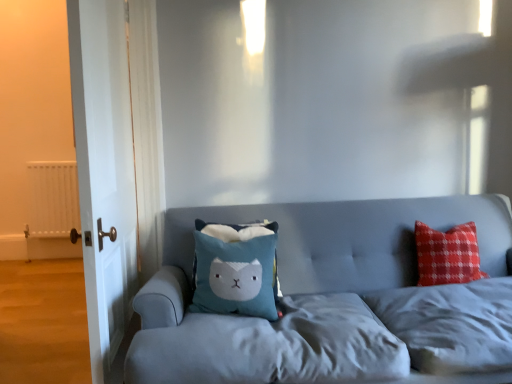
The width and height of the screenshot is (512, 384). What do you see at coordinates (303, 292) in the screenshot?
I see `velvet blue couch at center` at bounding box center [303, 292].

Describe the element at coordinates (236, 270) in the screenshot. The width and height of the screenshot is (512, 384). I see `blue plush pillow at center` at that location.

I want to click on white matte radiator at left, so click(52, 199).

Where is `white wood door at left`? white wood door at left is located at coordinates (104, 171).

Where is `velvet blue couch at center`? This screenshot has height=384, width=512. velvet blue couch at center is located at coordinates (303, 292).

Would you say white wood door at left is outside blue plush pillow at center?

Yes, white wood door at left is outside of blue plush pillow at center.

Is white wood door at left facing towards blue plush pillow at center?

Yes, white wood door at left is facing blue plush pillow at center.

Does point (112, 348) come farther from viewer compared to point (270, 230)?

No, it is in front of (270, 230).

What's the angular difference between white wood door at left and blue plush pillow at center's facing directions?

white wood door at left and blue plush pillow at center are facing 86.9 degrees away from each other.

Is velvet blue couch at center taller or shorter than white wood door at left?

In the image, velvet blue couch at center appears to be shorter than white wood door at left.

Would you say white wood door at left is part of velvet blue couch at center's contents?

No.

Find the location of `door lying above the velvet blue couch at center (from the image's perspective)`. door lying above the velvet blue couch at center (from the image's perspective) is located at coordinates (104, 171).

Is there a large distance between velvet blue couch at center and white wood door at left?

They are positioned close to each other.

Considering the sizes of white matte radiator at left and velvet blue couch at center in the image, is white matte radiator at left wider or thinner than velvet blue couch at center?

In the image, white matte radiator at left appears to be more narrow than velvet blue couch at center.

Image resolution: width=512 pixels, height=384 pixels. In the image, there is a white matte radiator at left. Find the location of `studio couch below it (from the image's perspective)`. studio couch below it (from the image's perspective) is located at coordinates (x=303, y=292).

Does white matte radiator at left appear on the left side of velvet blue couch at center?

Yes.

Would you say white matte radiator at left is a long distance from velvet blue couch at center?

Yes, white matte radiator at left and velvet blue couch at center are located far from each other.

Considering the relative positions of white matte radiator at left and white wood door at left in the image provided, is white matte radiator at left behind white wood door at left?

Yes, white matte radiator at left is further from the camera.

Is white matte radiator at left looking in the opposite direction of white wood door at left?

No, white matte radiator at left is not facing away from white wood door at left.

Is white matte radiator at left wider or thinner than white wood door at left?

Considering their sizes, white matte radiator at left looks slimmer than white wood door at left.

Which of these two, white matte radiator at left or white wood door at left, is bigger?

Bigger between the two is white wood door at left.

From the image's perspective, relative to white matte radiator at left, is white wood door at left above or below?

From the image's perspective, white wood door at left appears above white matte radiator at left.

Image resolution: width=512 pixels, height=384 pixels. Identify the location of radiator below the white wood door at left (from the image's perspective). (52, 199).

Between white wood door at left and white matte radiator at left, which one has less height?

With less height is white matte radiator at left.

Is white wood door at left closer to the viewer compared to white matte radiator at left?

Yes, it is.

Consider the image. Is white matte radiator at left positioned with its back to blue plush pillow at center?

That's not correct — white matte radiator at left is not looking away from blue plush pillow at center.

Who is smaller, white matte radiator at left or blue plush pillow at center?

blue plush pillow at center.

Considering the relative sizes of white matte radiator at left and blue plush pillow at center in the image provided, is white matte radiator at left thinner than blue plush pillow at center?

Correct, the width of white matte radiator at left is less than that of blue plush pillow at center.

Consider the image. Do you think white matte radiator at left is within blue plush pillow at center, or outside of it?

white matte radiator at left lies outside blue plush pillow at center.

Could blue plush pillow at center be considered to be inside velvet blue couch at center?

Yes, blue plush pillow at center can be found within velvet blue couch at center.

How different are the orientations of velvet blue couch at center and blue plush pillow at center in degrees?

They differ by 3.85 degrees in their facing directions.

Does velvet blue couch at center appear on the right side of blue plush pillow at center?

Yes.

Is velvet blue couch at center oriented away from blue plush pillow at center?

Yes, velvet blue couch at center is positioned with its back facing blue plush pillow at center.

Find the location of a particular element. Image resolution: width=512 pixels, height=384 pixels. pillow located below the white wood door at left (from the image's perspective) is located at coordinates (236, 270).

What are the coordinates of `door on the left of velvet blue couch at center` in the screenshot? It's located at (104, 171).

Based on their spatial positions, is velvet blue couch at center or white matte radiator at left further from white wood door at left?

Among the two, white matte radiator at left is located further to white wood door at left.

Looking at the image, which one is located further to blue plush pillow at center, white matte radiator at left or velvet blue couch at center?

white matte radiator at left is positioned further to the anchor blue plush pillow at center.

Based on their spatial positions, is white matte radiator at left or blue plush pillow at center closer to white wood door at left?

blue plush pillow at center.

Looking at the image, which one is located further to white wood door at left, white matte radiator at left or velvet blue couch at center?

white matte radiator at left lies further to white wood door at left than the other object.

Consider the image. When comparing their distances from blue plush pillow at center, does white wood door at left or white matte radiator at left seem closer?

The object closer to blue plush pillow at center is white wood door at left.

From the image, which object appears to be farther from white wood door at left, blue plush pillow at center or velvet blue couch at center?

Among the two, velvet blue couch at center is located further to white wood door at left.

When comparing their distances from white matte radiator at left, does white wood door at left or velvet blue couch at center seem closer?

white wood door at left lies closer to white matte radiator at left than the other object.

Looking at the image, which one is located closer to white matte radiator at left, velvet blue couch at center or white wood door at left?

white wood door at left lies closer to white matte radiator at left than the other object.

Where is `pillow located between white matte radiator at left and velvet blue couch at center in the left-right direction`? The height and width of the screenshot is (384, 512). pillow located between white matte radiator at left and velvet blue couch at center in the left-right direction is located at coordinates point(236,270).

You are a GUI agent. You are given a task and a screenshot of the screen. Output one action in this format:
    pyautogui.click(x=<x>, y=<y>)
    Task: Click on the door between velvet blue couch at center and white matte radiator at left in the front-back direction
    The height and width of the screenshot is (384, 512).
    Given the screenshot: What is the action you would take?
    pyautogui.click(x=104, y=171)

Where is `pillow between white wood door at left and velvet blue couch at center`? The image size is (512, 384). pillow between white wood door at left and velvet blue couch at center is located at coordinates (236, 270).

Image resolution: width=512 pixels, height=384 pixels. Identify the location of pillow between white wood door at left and white matte radiator at left in the front-back direction. (236, 270).